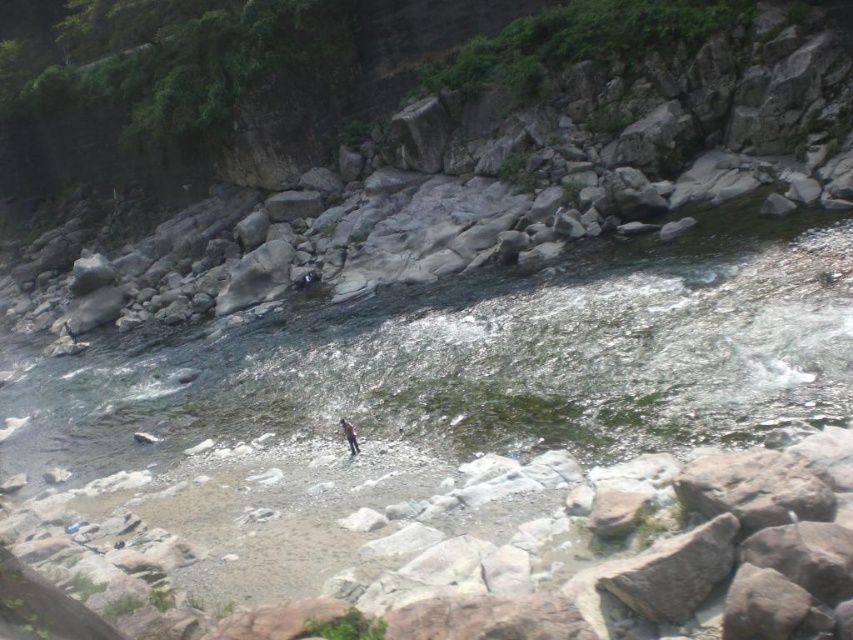
Between clear water at stream center and dark gray fabric person at center, which one is positioned higher?

Positioned higher is clear water at stream center.

Is point (659, 252) positioned behind point (352, 428)?

Yes, it is behind point (352, 428).

The width and height of the screenshot is (853, 640). Identify the location of clear water at stream center. (477, 360).